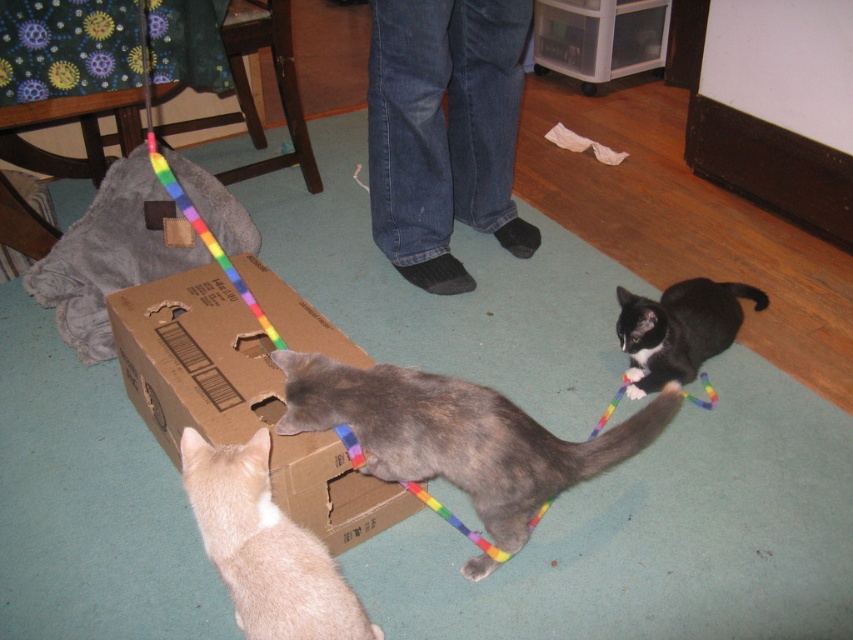
Between soft gray blanket at upper left and black glossy cat at lower right, which one has less height?

black glossy cat at lower right

You are a GUI agent. You are given a task and a screenshot of the screen. Output one action in this format:
    pyautogui.click(x=<x>, y=<y>)
    Task: Click on the soft gray blanket at upper left
    The image size is (853, 640).
    Given the screenshot: What is the action you would take?
    pyautogui.click(x=112, y=253)

Which is behind, point (376, 452) or point (115, 180)?

The point (115, 180) is behind.

Can you confirm if gray fur cat at center is wider than soft gray blanket at upper left?

Yes.

Describe the element at coordinates (457, 435) in the screenshot. The width and height of the screenshot is (853, 640). I see `gray fur cat at center` at that location.

Where is `gray fur cat at center`? The height and width of the screenshot is (640, 853). gray fur cat at center is located at coordinates [457, 435].

Which is below, gray fur cat at center or light orange fur at lower left?

Positioned lower is light orange fur at lower left.

What do you see at coordinates (457, 435) in the screenshot? The height and width of the screenshot is (640, 853). I see `gray fur cat at center` at bounding box center [457, 435].

Find the location of a particular element. This screenshot has width=853, height=640. gray fur cat at center is located at coordinates (457, 435).